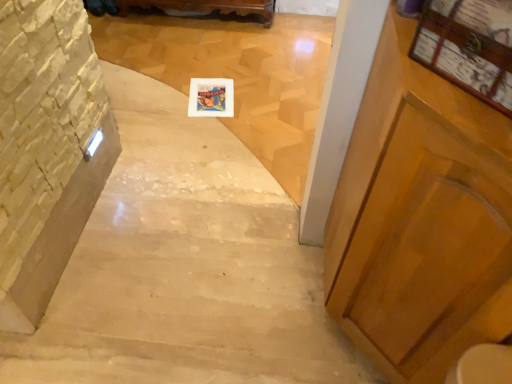
Question: From a real-world perspective, is wooden carved bench at upper center physically located above or below wooden frame at upper right?

Choices:
 (A) below
 (B) above

Answer: (A)

Question: Is wooden carved bench at upper center wider or thinner than wooden frame at upper right?

Choices:
 (A) wide
 (B) thin

Answer: (A)

Question: Which object is positioned closest to the white marble stairs at center, the 1th stairwell in the right-to-left sequence?

Choices:
 (A) wooden frame at center
 (B) stone textured wall at left, the 2th stairwell from the right
 (C) wooden frame at upper right
 (D) wooden carved bench at upper center

Answer: (A)

Question: Based on their relative distances, which object is farther from the white marble stairs at center, the 1th stairwell in the right-to-left sequence?

Choices:
 (A) wooden carved bench at upper center
 (B) wooden frame at upper right
 (C) wooden frame at center
 (D) stone textured wall at left, positioned as the first stairwell in left-to-right order

Answer: (B)